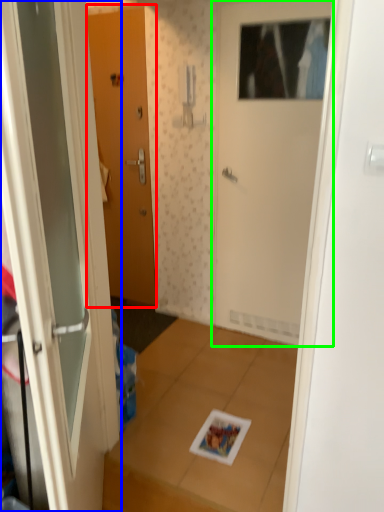
Question: Which is nearer to the door (highlighted by a red box)? door (highlighted by a blue box) or door (highlighted by a green box).

Choices:
 (A) door
 (B) door

Answer: (B)